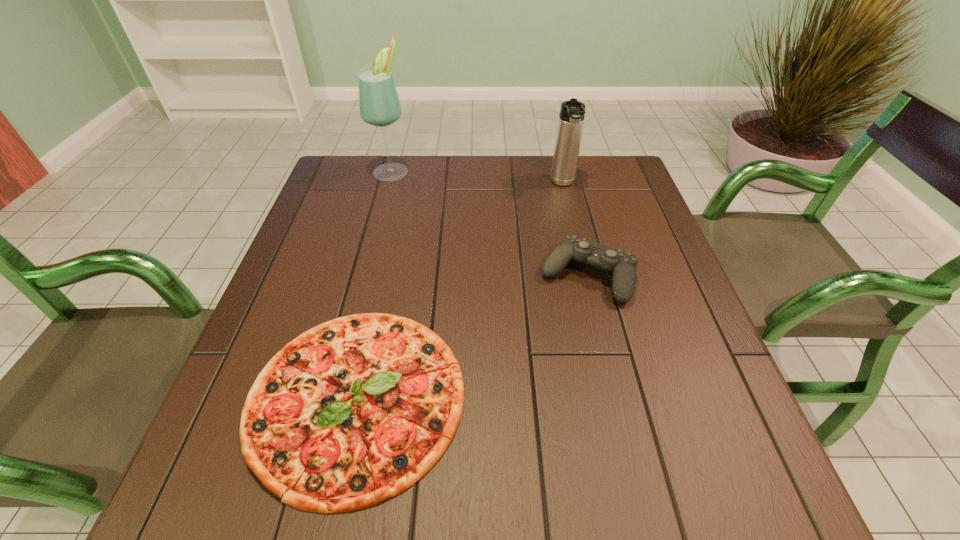
Locate an element on the screen. The height and width of the screenshot is (540, 960). vacant space at the left edge of the desktop is located at coordinates (336, 204).

This screenshot has width=960, height=540. In the image, there is a desktop. Identify the location of vacant space at the right edge. (640, 201).

This screenshot has width=960, height=540. In order to click on vacant space at the far left corner of the desktop in this screenshot , I will do `click(358, 157)`.

Find the location of a particular element. This screenshot has height=540, width=960. blank region between the alcohol and the third tallest object is located at coordinates (490, 224).

The image size is (960, 540). I want to click on vacant space in between the third shortest object and the shortest object, so click(x=460, y=291).

Find the location of `free space between the third tallest object and the thermos bottle`. free space between the third tallest object and the thermos bottle is located at coordinates (575, 230).

At what (x,y) coordinates should I click in order to perform the action: click on vacant region between the nearest object and the control. Please return your answer as a coordinate pair (x, y). The height and width of the screenshot is (540, 960). Looking at the image, I should click on (471, 336).

Identify the location of free space between the nearest object and the tallest object. This screenshot has height=540, width=960. (374, 284).

You are a GUI agent. You are given a task and a screenshot of the screen. Output one action in this format:
    pyautogui.click(x=<x>, y=<y>)
    Task: Click on the unoccupied position between the control and the alcohol
    The height and width of the screenshot is (540, 960).
    Given the screenshot: What is the action you would take?
    coord(490,224)

Locate an element on the screen. empty space between the second tallest object and the second nearest object is located at coordinates (575, 230).